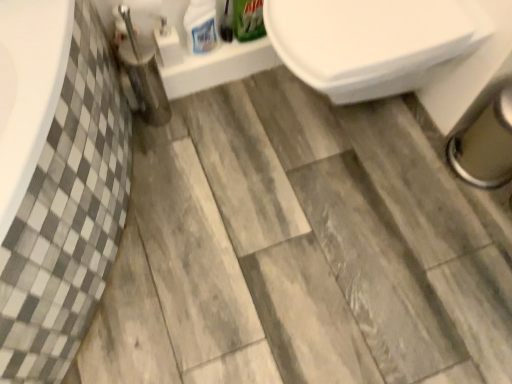
Question: From a real-world perspective, relative to white glossy bottle at upper center, which is the 2th cleaning product from right to left, is white glossy toilet at upper right vertically above or below?

Choices:
 (A) below
 (B) above

Answer: (A)

Question: Considering the positions of white glossy toilet at upper right and white glossy bottle at upper center, placed as the first cleaning product when sorted from left to right, in the image, is white glossy toilet at upper right taller or shorter than white glossy bottle at upper center, placed as the first cleaning product when sorted from left to right,?

Choices:
 (A) short
 (B) tall

Answer: (B)

Question: Which is nearer to the white glossy toilet at upper right?

Choices:
 (A) green matte box at upper center, acting as the second cleaning product starting from the left
 (B) brushed metal toilet brush at lower left
 (C) white glossy bottle at upper center, placed as the first cleaning product when sorted from left to right

Answer: (A)

Question: Which is farther from the green matte box at upper center, which is the 1th cleaning product in right-to-left order?

Choices:
 (A) brushed metal toilet brush at lower left
 (B) white glossy bottle at upper center, which is the 2th cleaning product from right to left
 (C) white glossy toilet at upper right

Answer: (C)